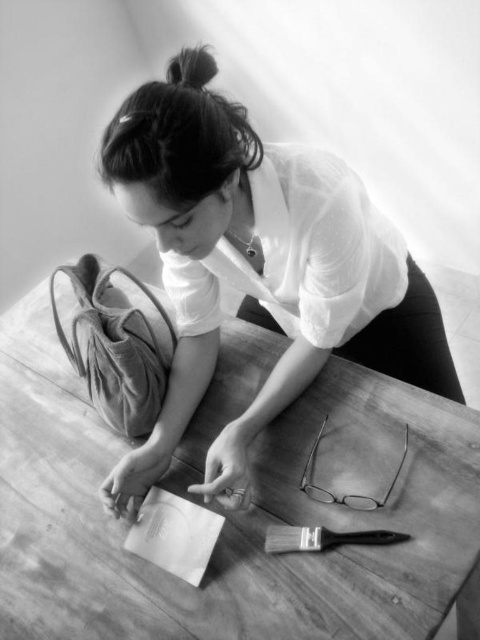
Question: Can you confirm if wooden table at center is thinner than velvet-like fabric shoe at lower left?

Choices:
 (A) no
 (B) yes

Answer: (A)

Question: Which of these objects is positioned closest to the smooth white blouse at upper center?

Choices:
 (A) wooden table at center
 (B) black matte paintbrush at lower center
 (C) velvet-like fabric shoe at lower left

Answer: (C)

Question: Which of these objects is positioned closest to the smooth white blouse at upper center?

Choices:
 (A) black matte paintbrush at lower center
 (B) wooden table at center

Answer: (B)

Question: Does wooden table at center appear over velvet-like fabric shoe at lower left?

Choices:
 (A) no
 (B) yes

Answer: (A)

Question: Estimate the real-world distances between objects in this image. Which object is closer to the velvet-like fabric shoe at lower left?

Choices:
 (A) smooth white blouse at upper center
 (B) wooden table at center

Answer: (A)

Question: Can you confirm if smooth white blouse at upper center is thinner than velvet-like fabric shoe at lower left?

Choices:
 (A) no
 (B) yes

Answer: (A)